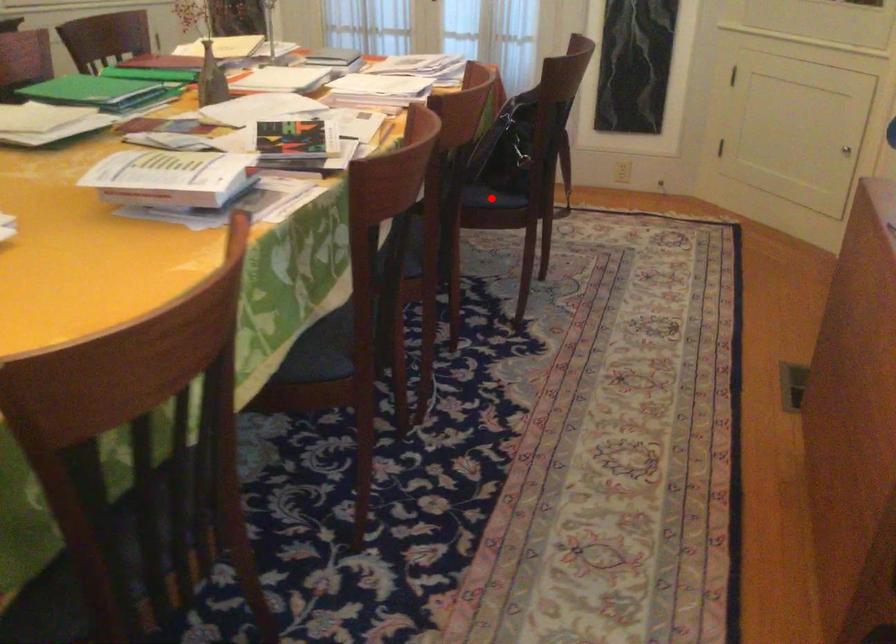
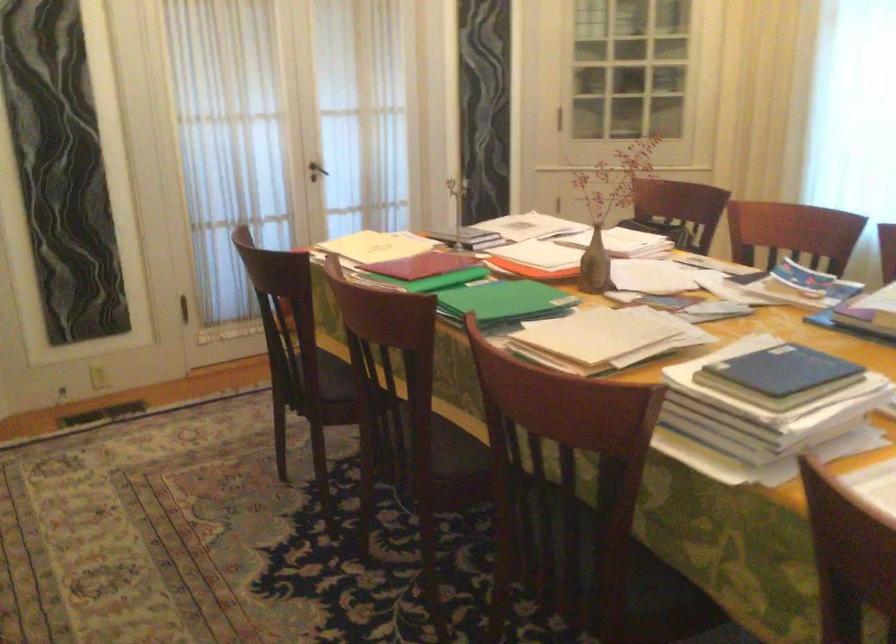
Question: I am providing you with two images of the same scene from different viewpoints. A red point is marked on the first image. Can you still see the location of the red point in image 2?

Choices:
 (A) Yes
 (B) No

Answer: (B)